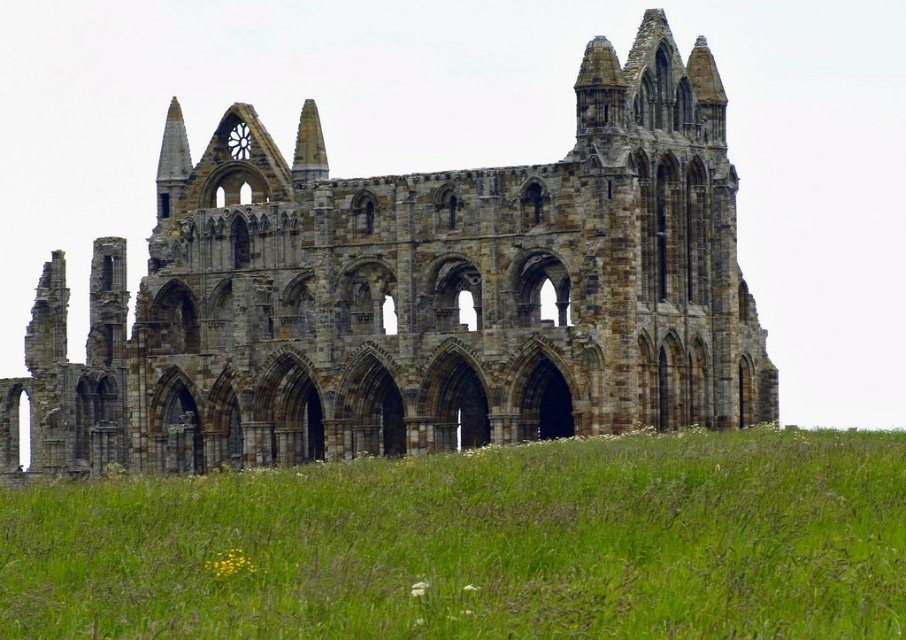
Question: Is brown stone ruins at center wider than green grass at lower center?

Choices:
 (A) no
 (B) yes

Answer: (B)

Question: Which object appears closest to the camera in this image?

Choices:
 (A) green grass at lower center
 (B) brown stone ruins at center

Answer: (A)

Question: Is brown stone ruins at center to the left of green grass at lower center from the viewer's perspective?

Choices:
 (A) no
 (B) yes

Answer: (B)

Question: Which point is farther from the camera taking this photo?

Choices:
 (A) (759, 484)
 (B) (143, 291)

Answer: (B)

Question: Does brown stone ruins at center have a larger size compared to green grass at lower center?

Choices:
 (A) no
 (B) yes

Answer: (B)

Question: Which of the following is the farthest from the observer?

Choices:
 (A) (733, 509)
 (B) (435, 412)

Answer: (B)